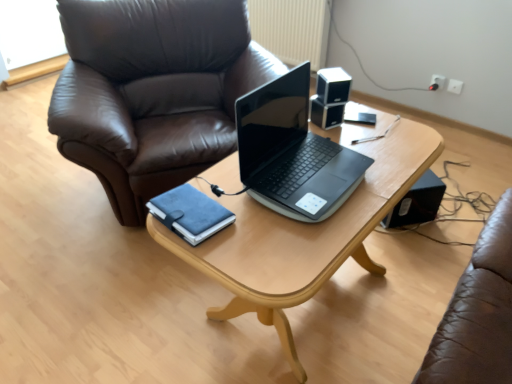
You are a GUI agent. You are given a task and a screenshot of the screen. Output one action in this format:
    pyautogui.click(x=<x>, y=<y>)
    Task: Click on the empty space that is ontop of light wood table at center (from a real-world perspective)
    
    Given the screenshot: What is the action you would take?
    pyautogui.click(x=330, y=207)